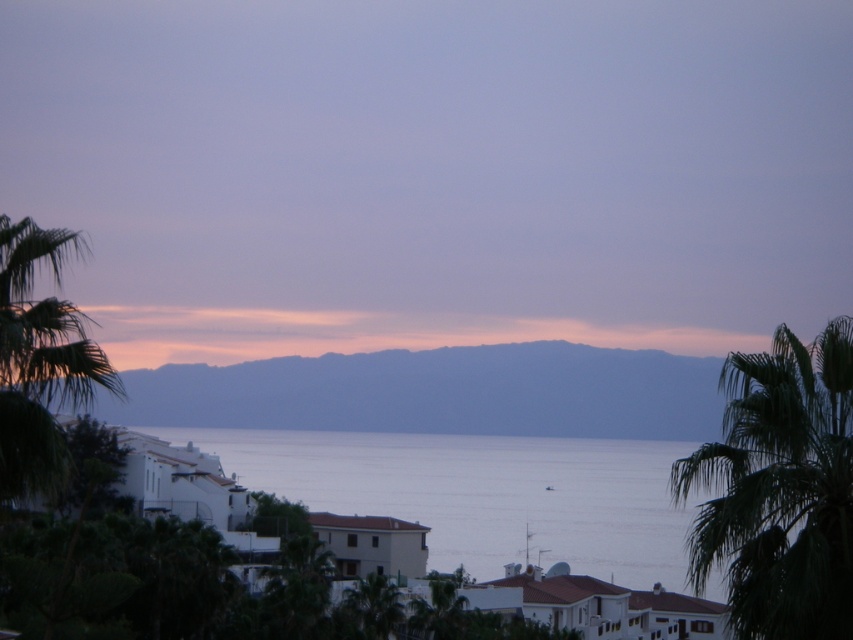
You are standing in the coastal scene and want to take a photo of the dull blue sky at center and the green leafy palm tree at right. Which object will appear larger in your photo?

The dull blue sky at center will appear larger in your photo because it is closer to the viewer than the green leafy palm tree at right.

You are an artist planning to paint the scene. You need to decide which area to focus on first based on their sizes. Which of the two, the blue water at center or the dull blue sky at center, is narrower in width?

The blue water at center is narrower in width than the dull blue sky at center.